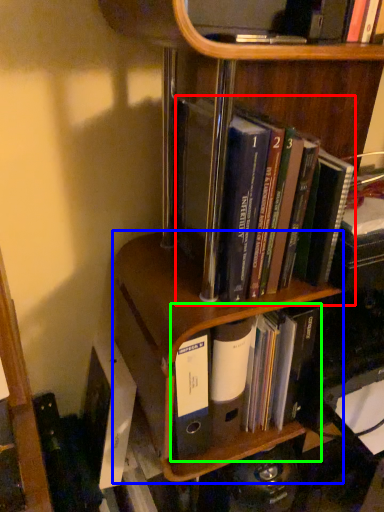
Question: Which object is positioned farthest from book (highlighted by a red box)? Select from shelf (highlighted by a blue box) and book (highlighted by a green box).

Choices:
 (A) shelf
 (B) book

Answer: (B)